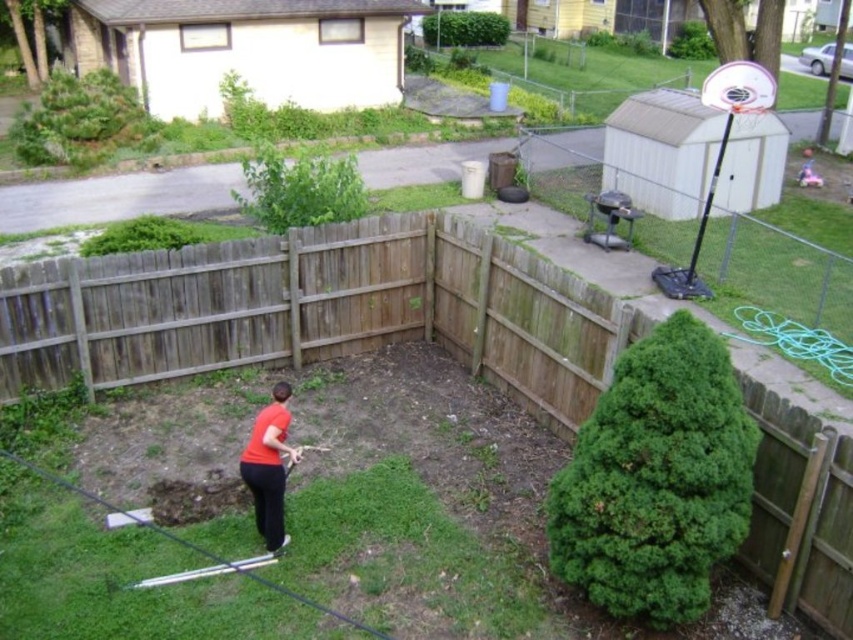
You are a photographer holding a camera. You want to capture a photo of the brown wood fence at center from a distance that allows you to include the entire fence in the frame. If your camera has a maximum zoom range of 5 meters, will you be able to take the photo without moving closer?

The brown wood fence at center and camera are 5.88 meters apart. Since the camera can only zoom up to 5 meters, you need to move closer to ensure the entire fence fits in the frame.

You are a painter who needs to set up an easel between the brown wood fence at center and the weathered wood fence at center. The easel requires a minimum of 2 meters of space to be safely positioned. Can you fit the easel between them?

The distance between the brown wood fence at center and the weathered wood fence at center is 3.09 meters, which is more than the required 2 meters. Therefore, the easel can be safely positioned between them.